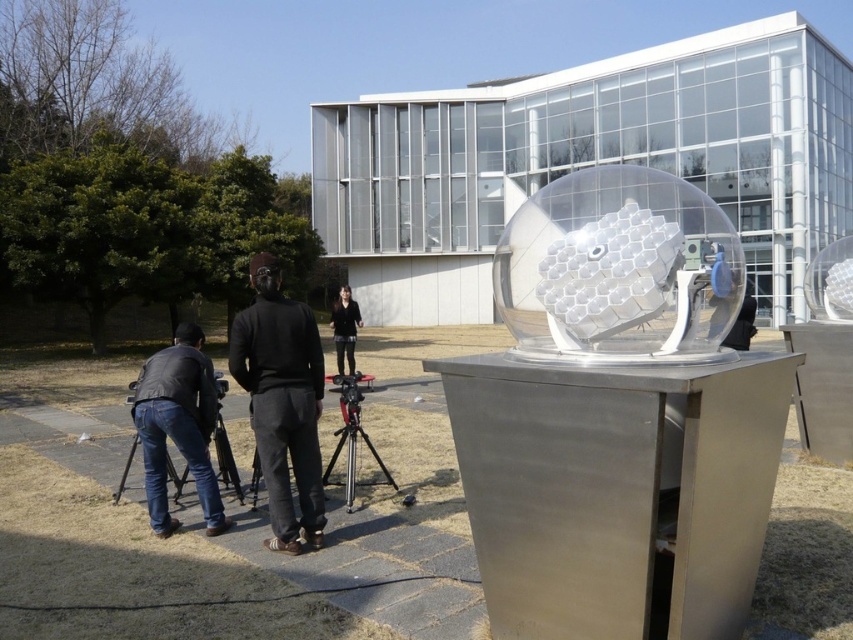
Question: Is matte black tripod at lower left behind metallic tripod at center?

Choices:
 (A) yes
 (B) no

Answer: (B)

Question: Among these points, which one is farthest from the camera?

Choices:
 (A) (273, 435)
 (B) (527, 262)
 (C) (351, 456)

Answer: (C)

Question: Which object is closer to the camera taking this photo?

Choices:
 (A) transparent plastic sphere at center
 (B) jeans at lower left
 (C) matte black tripod at lower left
 (D) black matte pants at center

Answer: (A)

Question: Observing the image, what is the correct spatial positioning of jeans at lower left in reference to matte black tripod at lower left?

Choices:
 (A) above
 (B) below

Answer: (B)

Question: Is jeans at lower left bigger than metallic tripod at center?

Choices:
 (A) yes
 (B) no

Answer: (B)

Question: Which object is farther from the camera taking this photo?

Choices:
 (A) black matte jacket at center
 (B) metallic tripod at center
 (C) transparent plastic sphere at center
 (D) matte black tripod at lower left

Answer: (A)